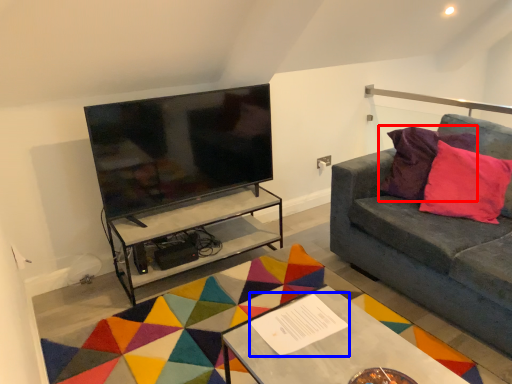
Question: Which object appears closest to the camera in this image, pillow (highlighted by a red box) or square (highlighted by a blue box)?

Choices:
 (A) pillow
 (B) square

Answer: (B)